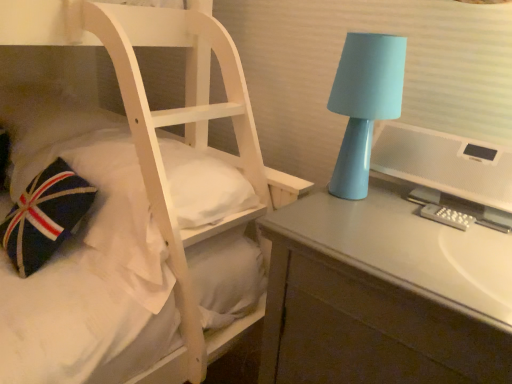
Image resolution: width=512 pixels, height=384 pixels. Find the location of `free spot below white textured computer monitor at right (from a real-world perspective)`. free spot below white textured computer monitor at right (from a real-world perspective) is located at coordinates (438, 209).